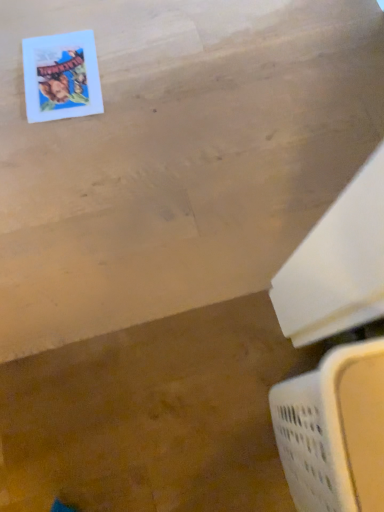
The image size is (384, 512). What are the coordinates of `blank area beneath matte paper comic book at upper left (from a real-world perspective)` in the screenshot? It's located at [64, 75].